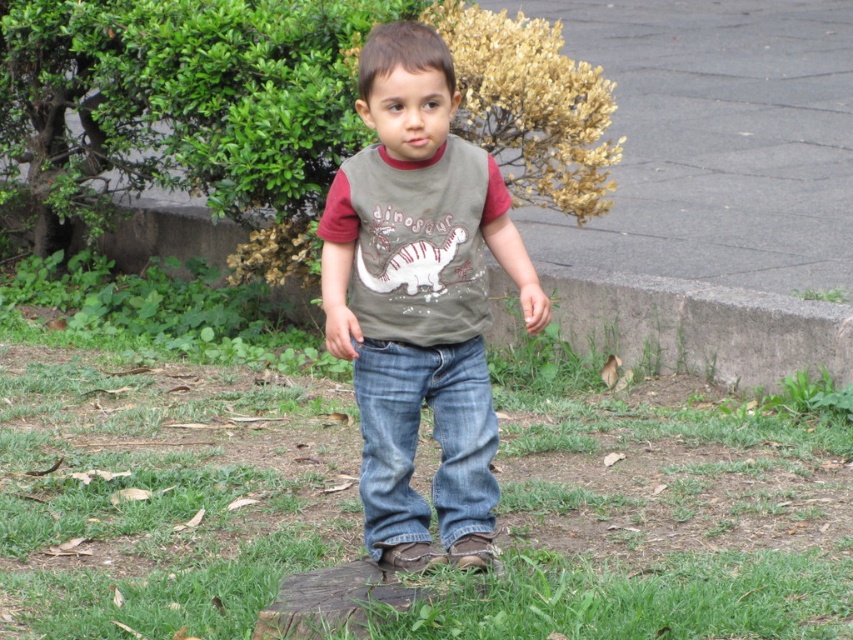
Question: Among these points, which one is nearest to the camera?

Choices:
 (A) (136, 550)
 (B) (677, 177)
 (C) (329, 296)

Answer: (C)

Question: Does green grass at center have a greater width compared to gray asphalt pavement at upper center?

Choices:
 (A) yes
 (B) no

Answer: (B)

Question: Among these points, which one is nearest to the camera?

Choices:
 (A) (726, 481)
 (B) (492, 420)
 (C) (399, 128)
 (D) (625, 13)

Answer: (C)

Question: Does green grass at center have a lesser width compared to matte gray t-shirt at center?

Choices:
 (A) yes
 (B) no

Answer: (B)

Question: Among these objects, which one is nearest to the camera?

Choices:
 (A) green grass at center
 (B) denim jeans at center
 (C) gray asphalt pavement at upper center

Answer: (A)

Question: Where is gray asphalt pavement at upper center located in relation to matte gray t-shirt at center in the image?

Choices:
 (A) right
 (B) left

Answer: (A)